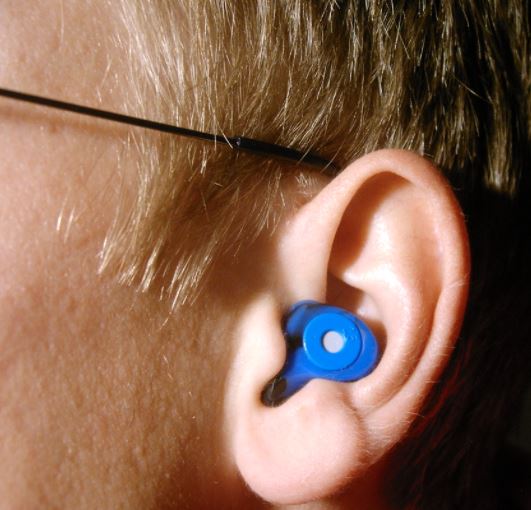
You are a GUI agent. You are given a task and a screenshot of the screen. Output one action in this format:
    pyautogui.click(x=<x>, y=<y>)
    Task: Click on the black part of earbud
    Image resolution: width=531 pixels, height=510 pixels.
    Given the screenshot: What is the action you would take?
    pyautogui.click(x=277, y=384)